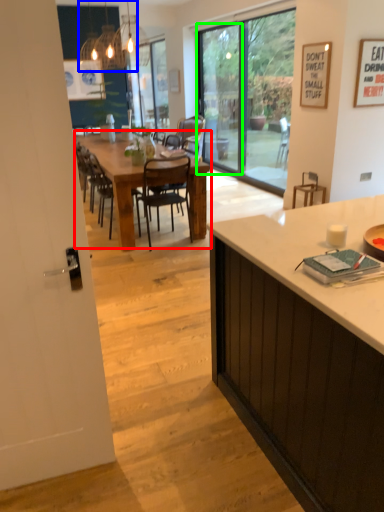
Question: Which object is positioned farthest from kitchen & dining room table (highlighted by a red box)? Select from light fixture (highlighted by a blue box) and screen door (highlighted by a green box).

Choices:
 (A) light fixture
 (B) screen door

Answer: (A)